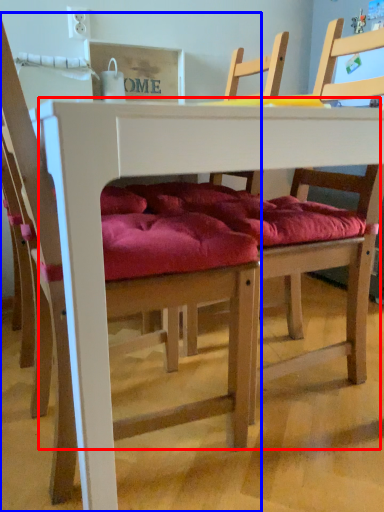
Question: Among these objects, which one is farthest to the camera, table (highlighted by a red box) or chair (highlighted by a blue box)?

Choices:
 (A) table
 (B) chair

Answer: (A)